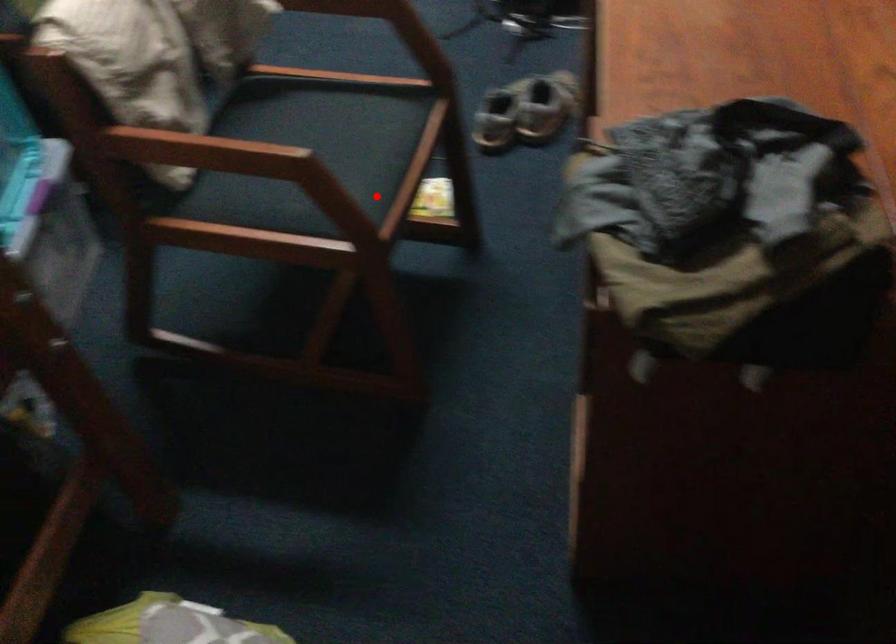
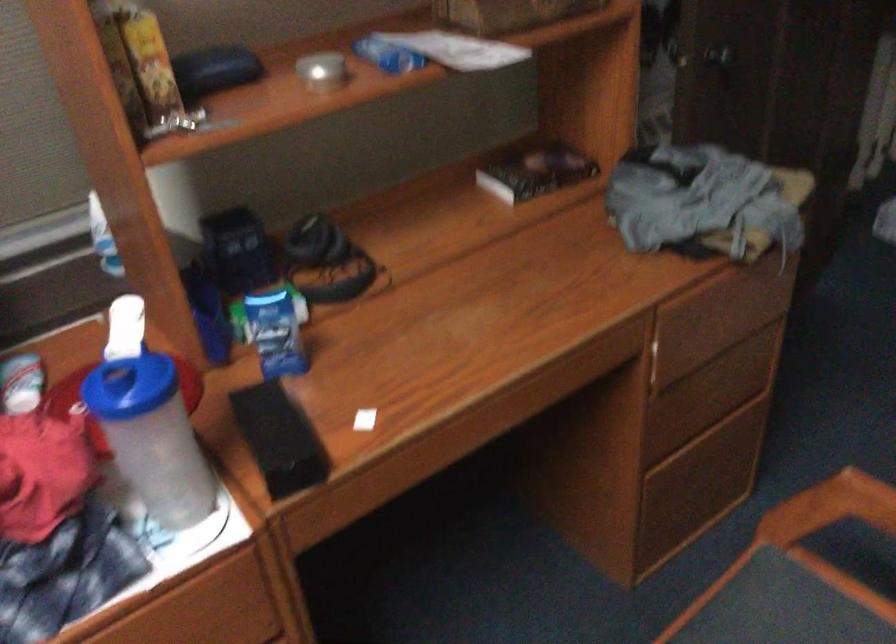
Locate, in the second image, the point that corresponds to the highlighted location in the first image.

(830, 507)